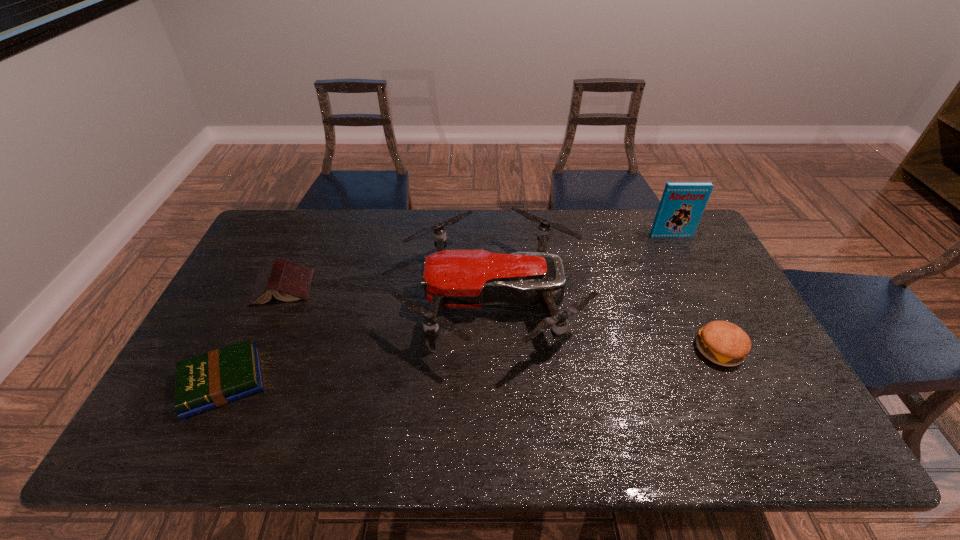
What are the coordinates of `free region located 0.120m on the front-facing side of the drone` in the screenshot? It's located at (363, 298).

Image resolution: width=960 pixels, height=540 pixels. What are the coordinates of `free space located 0.370m on the front-facing side of the drone` in the screenshot? It's located at (279, 298).

Identify the location of vacant space located on the front-facing side of the drone. This screenshot has height=540, width=960. (366, 298).

Locate an element on the screen. free space located on the back of the third tallest object is located at coordinates (700, 308).

Identify the location of vacant position located 0.320m on the right of the fourth tallest object. The image size is (960, 540). (418, 288).

At what (x,y) coordinates should I click in order to perform the action: click on free space located 0.290m on the right of the shortest object. Please return your answer as a coordinate pair (x, y). The width and height of the screenshot is (960, 540). Looking at the image, I should click on (383, 382).

This screenshot has width=960, height=540. What are the coordinates of `book at the far edge` in the screenshot? It's located at point(682,204).

Where is `drone that is at the far edge`? This screenshot has width=960, height=540. drone that is at the far edge is located at coordinates (452, 278).

Where is `object at the near edge`? This screenshot has width=960, height=540. object at the near edge is located at coordinates (213, 379).

This screenshot has height=540, width=960. Identify the location of book positioned at the right edge. (682, 204).